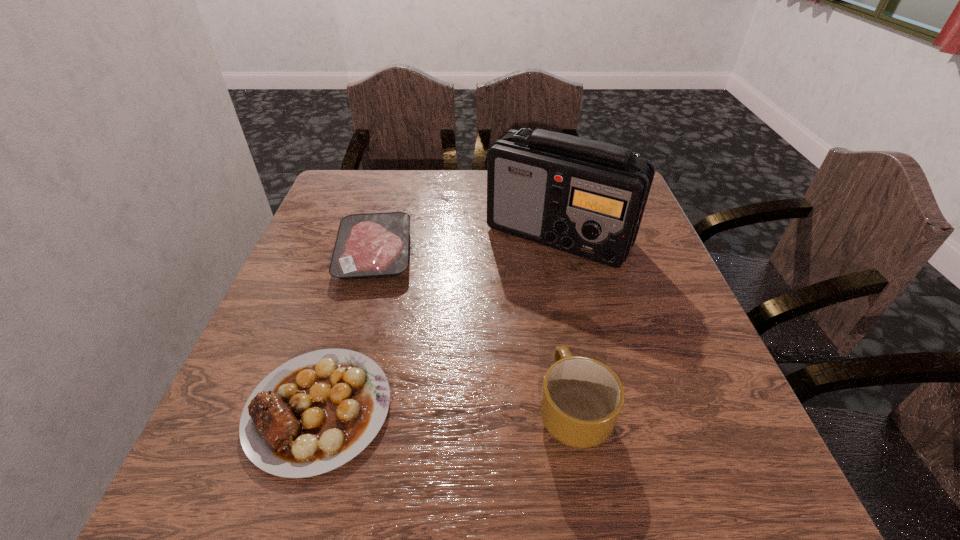
Find the location of `vacant space located 0.370m on the right of the third tallest object`. vacant space located 0.370m on the right of the third tallest object is located at coordinates (614, 409).

What are the coordinates of `free location located 0.360m on the right of the shortest object` in the screenshot? It's located at (568, 253).

Locate an element on the screen. This screenshot has height=540, width=960. object present at the far edge is located at coordinates (584, 197).

The width and height of the screenshot is (960, 540). Find the location of `mug located in the near edge section of the desktop`. mug located in the near edge section of the desktop is located at coordinates (581, 399).

At what (x,y) coordinates should I click in order to perform the action: click on steak that is at the near edge. Please return your answer as a coordinate pair (x, y). The height and width of the screenshot is (540, 960). Looking at the image, I should click on (314, 413).

This screenshot has width=960, height=540. Find the location of `object at the right edge`. object at the right edge is located at coordinates (584, 197).

The height and width of the screenshot is (540, 960). What are the coordinates of `object that is at the near left corner` in the screenshot? It's located at (314, 413).

You are a GUI agent. You are given a task and a screenshot of the screen. Output one action in this format:
    pyautogui.click(x=<x>, y=<y>)
    Task: Click on the object that is at the far right corner
    
    Given the screenshot: What is the action you would take?
    pyautogui.click(x=584, y=197)

Where is `free region at the far edge of the desktop`? The height and width of the screenshot is (540, 960). free region at the far edge of the desktop is located at coordinates (470, 199).

Image resolution: width=960 pixels, height=540 pixels. In order to click on vacant space at the near edge of the desktop in this screenshot , I will do `click(595, 463)`.